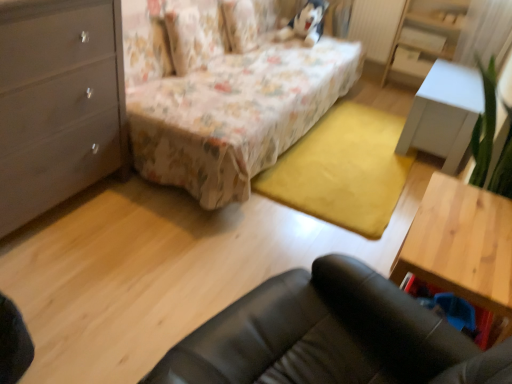
Identify the location of empty space that is in between white glossy table at right, the second table in the bottom-to-top sequence, and floral fabric bed at center. The image size is (512, 384). (350, 154).